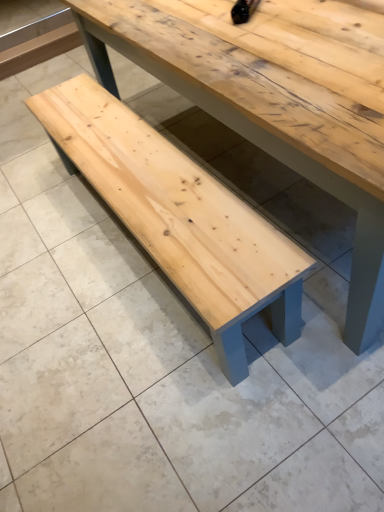
This screenshot has height=512, width=384. What are the coordinates of `natural wood bench at lower left` in the screenshot? It's located at (179, 217).

The image size is (384, 512). Describe the element at coordinates (179, 217) in the screenshot. I see `natural wood bench at lower left` at that location.

Find the location of a particular element. Image resolution: width=384 pixels, height=512 pixels. natural wood bench at lower left is located at coordinates (179, 217).